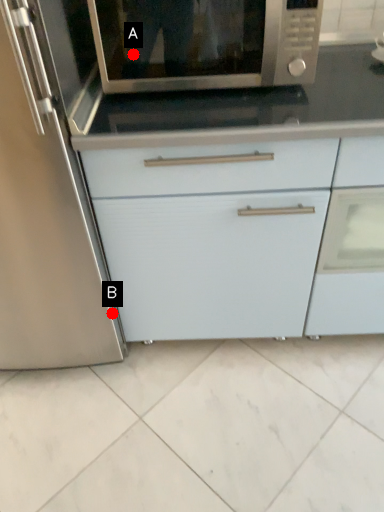
Question: Two points are circled on the image, labeled by A and B beside each circle. Which point appears farthest from the camera in this image?

Choices:
 (A) A is further
 (B) B is further

Answer: (B)